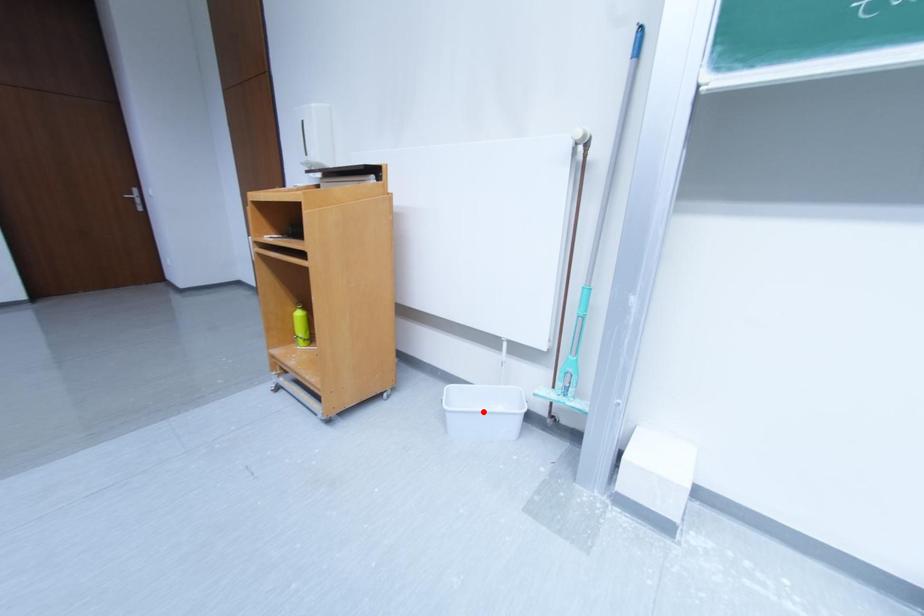
Question: Two points are marked on the image. Which point is closer to the camera?

Choices:
 (A) Blue point is closer.
 (B) Red point is closer.

Answer: (A)